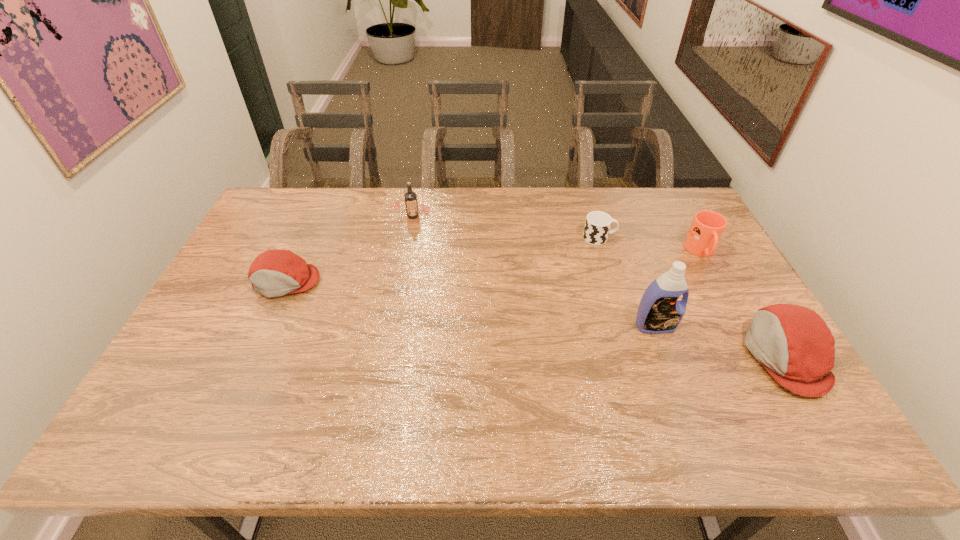
In order to click on vacant region located on the front-facing side of the nearer cap in this screenshot , I will do `click(611, 356)`.

Locate an element on the screen. The width and height of the screenshot is (960, 540). free space located on the front-facing side of the nearer cap is located at coordinates (728, 356).

You are a GUI agent. You are given a task and a screenshot of the screen. Output one action in this format:
    pyautogui.click(x=<x>, y=<y>)
    Task: Click on the blank space located on the front-facing side of the nearer cap
    The image size is (960, 540).
    Given the screenshot: What is the action you would take?
    pyautogui.click(x=697, y=356)

I want to click on free region located 0.060m on the handle side of the mug, so coord(716,280).

Locate an element on the screen. The width and height of the screenshot is (960, 540). free location located 0.340m on the label of the farthest object is located at coordinates (x=397, y=299).

You are a GUI agent. You are given a task and a screenshot of the screen. Output one action in this format:
    pyautogui.click(x=<x>, y=<y>)
    Task: Click on the vacant area situated on the side of the cup with the handle
    The image size is (960, 540).
    Given the screenshot: What is the action you would take?
    pyautogui.click(x=639, y=238)

You are a GUI agent. You are given a task and a screenshot of the screen. Output one action in this format:
    pyautogui.click(x=<x>, y=<y>)
    Task: Click on the vacant position located 0.340m on the back of the tallest object
    The image size is (960, 540).
    Given the screenshot: What is the action you would take?
    pyautogui.click(x=623, y=240)

Identify the location of object that is positioned at the far edge. This screenshot has width=960, height=540. (410, 197).

Locate an element on the screen. The width and height of the screenshot is (960, 540). object that is at the near edge is located at coordinates (796, 346).

Find the location of `object at the left edge`. object at the left edge is located at coordinates (276, 272).